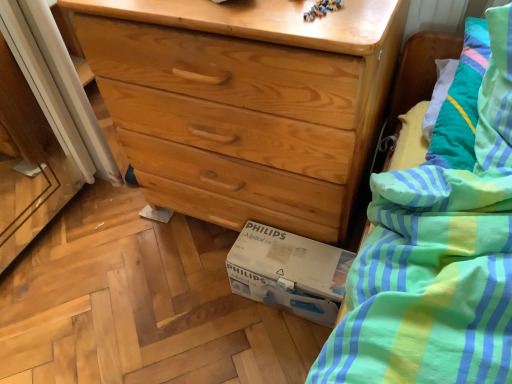
Where is `free space to the left of white cardboard box at lower center`? free space to the left of white cardboard box at lower center is located at coordinates (206, 305).